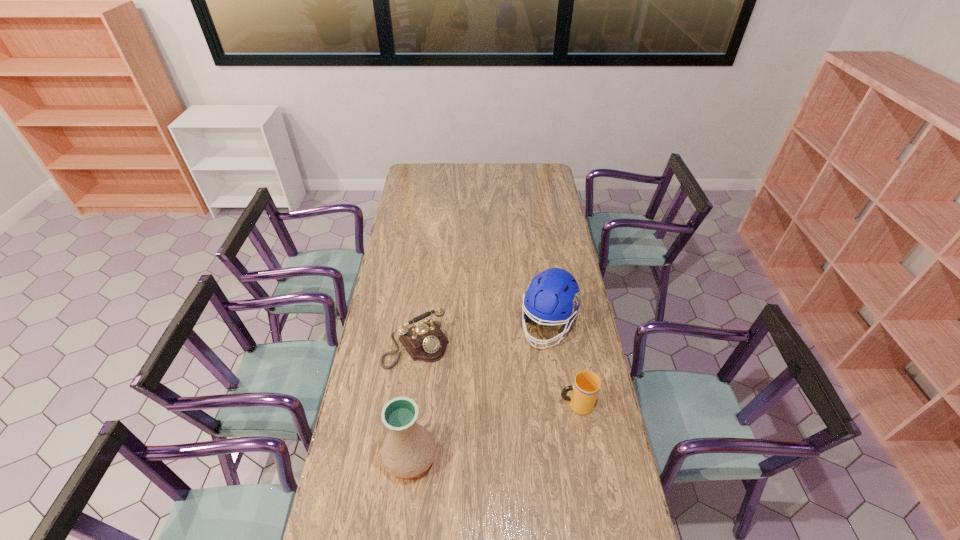
The height and width of the screenshot is (540, 960). I want to click on the nearest object, so click(408, 451).

Locate an element on the screen. cup is located at coordinates (584, 391).

Find the location of a particular element. This screenshot has height=540, width=960. telephone is located at coordinates (424, 341).

Where is `football helmet`? This screenshot has width=960, height=540. football helmet is located at coordinates (553, 296).

Locate an element on the screen. vacant space located 0.070m on the front of the pottery is located at coordinates (404, 509).

Find the location of a particular element. The height and width of the screenshot is (540, 960). vacant space located on the side of the cup with the handle is located at coordinates (544, 404).

Identify the location of vacant space situated on the side of the cup with the handle. This screenshot has width=960, height=540. (534, 404).

Locate an element on the screen. This screenshot has height=540, width=960. vacant space located on the side of the cup with the handle is located at coordinates (506, 404).

The image size is (960, 540). In order to click on vacant point located 0.370m on the dial of the telephone in this screenshot , I will do `click(486, 441)`.

Locate an element on the screen. This screenshot has height=540, width=960. vacant area situated on the dial of the telephone is located at coordinates (442, 379).